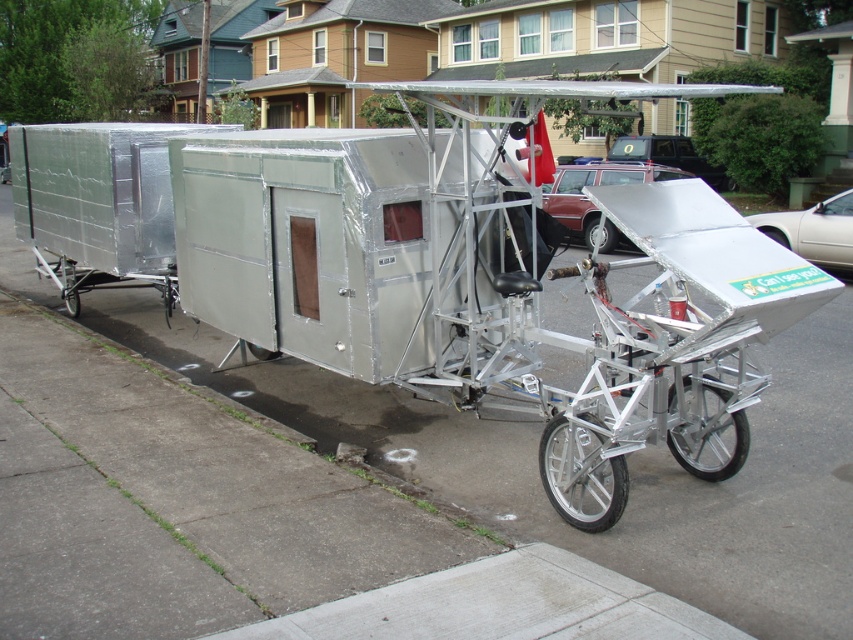
You are a delivery driver who needs to attach a new license plate to the trailer. The license plate must be placed on the wheel that is further back. Which wheel should you choose between the silver metallic wheel at lower center and the silver metallic wheel at center?

The silver metallic wheel at center is further back than the silver metallic wheel at lower center, so you should attach the license plate to the silver metallic wheel at center.

You are a delivery person who needs to load a package onto the trailer. The package requires that the loading area must be higher than the silver metallic wheel at lower center. Is the silver metallic wheel at center tall enough to meet this requirement?

The silver metallic wheel at lower center is not as tall as the silver metallic wheel at center, so the silver metallic wheel at center is taller and meets the requirement.